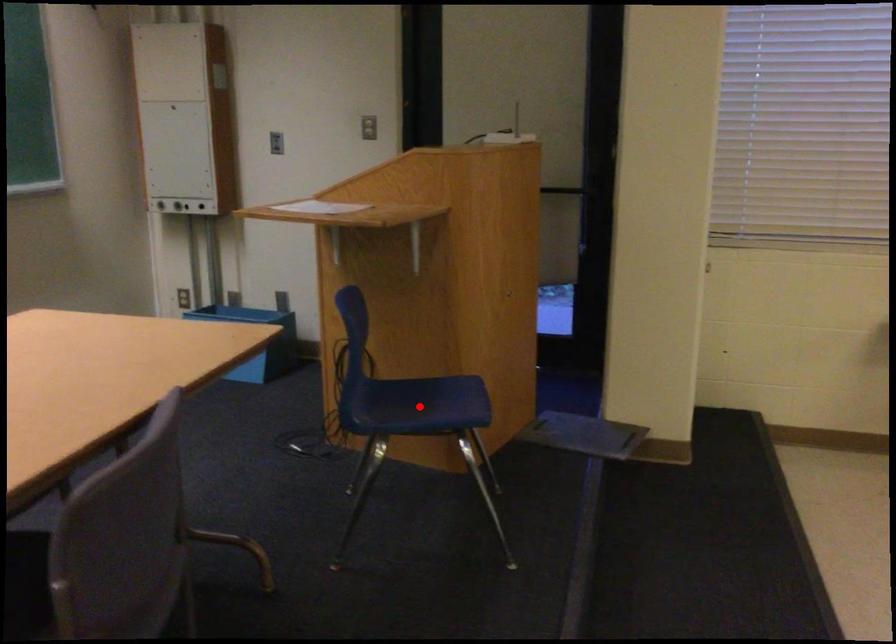
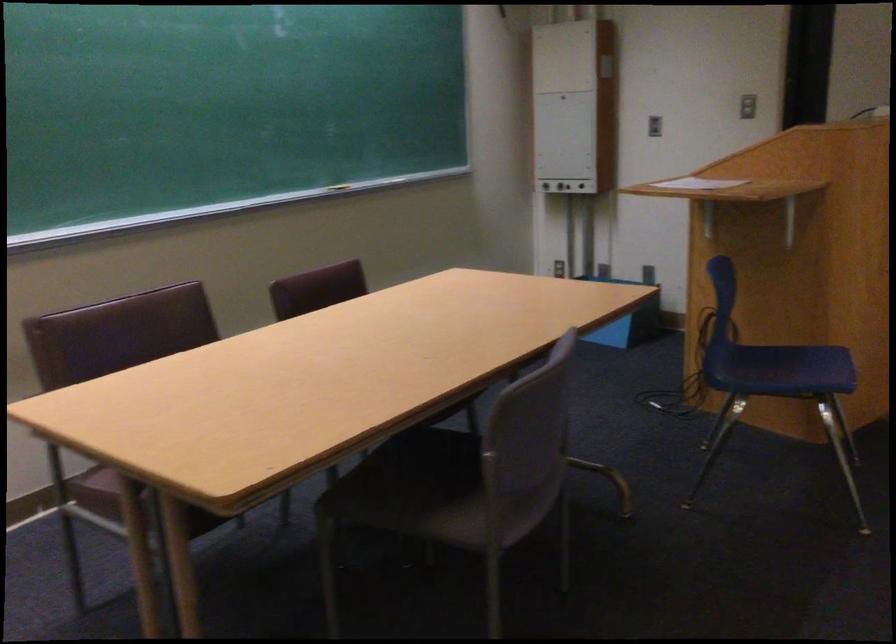
Where in the second image is the point corresponding to the highlighted location from the first image?

(782, 368)